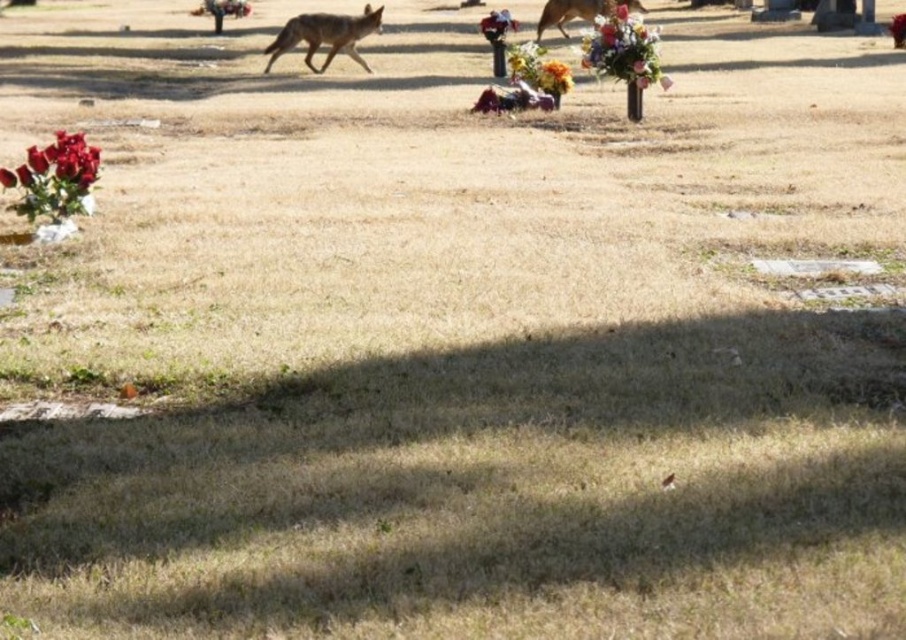
Is brown fur dog at upper center behind matte floral bouquet at center?

No, brown fur dog at upper center is closer to the viewer.

In the scene shown: Is brown fur dog at upper center in front of matte floral bouquet at center?

Yes, brown fur dog at upper center is in front of matte floral bouquet at center.

The width and height of the screenshot is (906, 640). Find the location of `brown fur dog at upper center`. brown fur dog at upper center is located at coordinates (577, 12).

Identify the location of brown fur dog at upper center. (577, 12).

Is point (599, 19) closer to camera compared to point (489, 19)?

Yes, point (599, 19) is in front of point (489, 19).

Does floral bouquet at upper center have a lesser height compared to matte floral bouquet at center?

Yes, floral bouquet at upper center is shorter than matte floral bouquet at center.

What do you see at coordinates (623, 49) in the screenshot? I see `floral bouquet at upper center` at bounding box center [623, 49].

Where is `floral bouquet at upper center`? The image size is (906, 640). floral bouquet at upper center is located at coordinates (623, 49).

Is floral bouquet at center to the right of smooth plastic vase at center from the viewer's perspective?

In fact, floral bouquet at center is to the left of smooth plastic vase at center.

Locate an element on the screen. floral bouquet at center is located at coordinates (538, 68).

The height and width of the screenshot is (640, 906). Find the location of `floral bouquet at center`. floral bouquet at center is located at coordinates (538, 68).